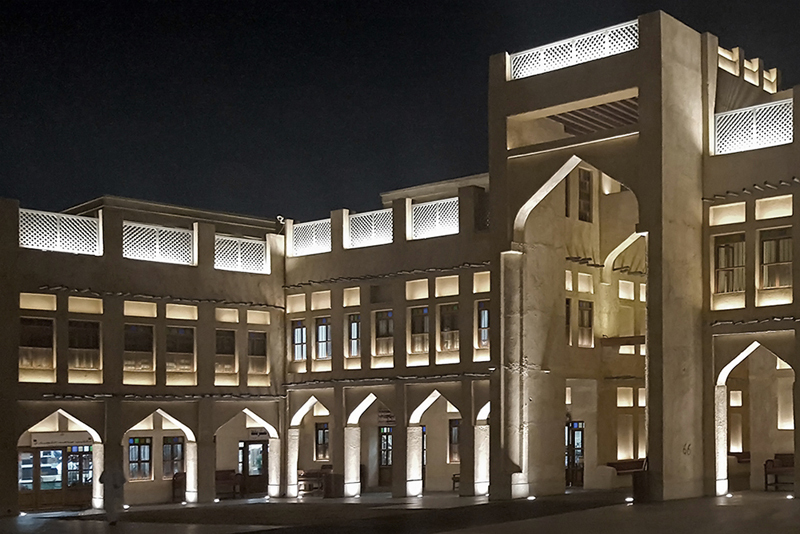
Find the location of `doors`. doors is located at coordinates (70, 489), (82, 488), (253, 479), (386, 456), (574, 449).